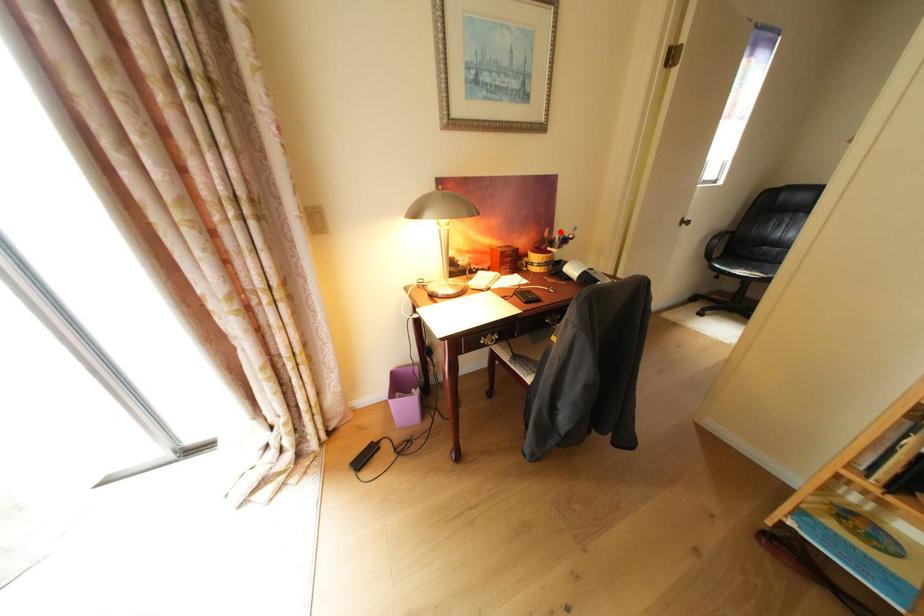
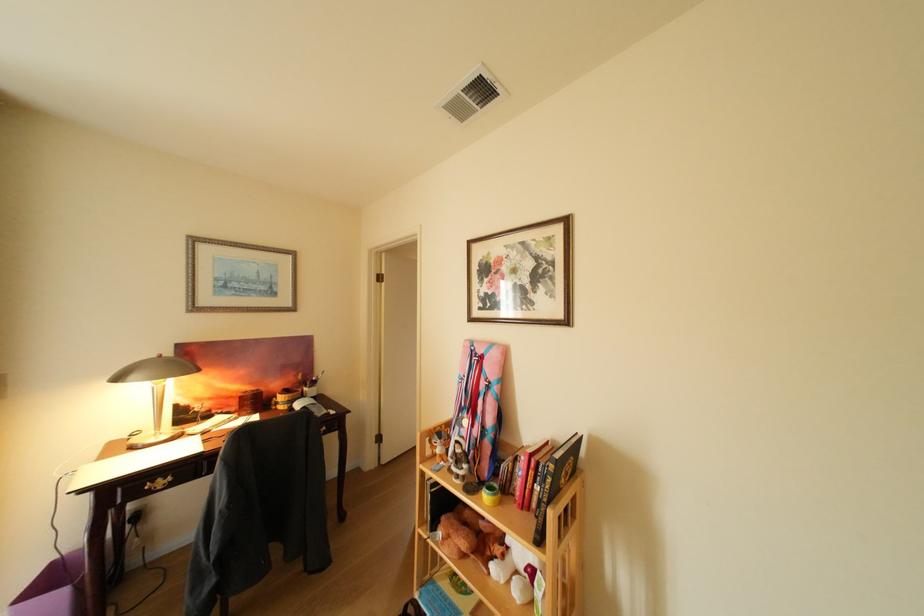
Locate, in the second image, the point that corresponds to the highlighted location in the first image.

(313, 376)